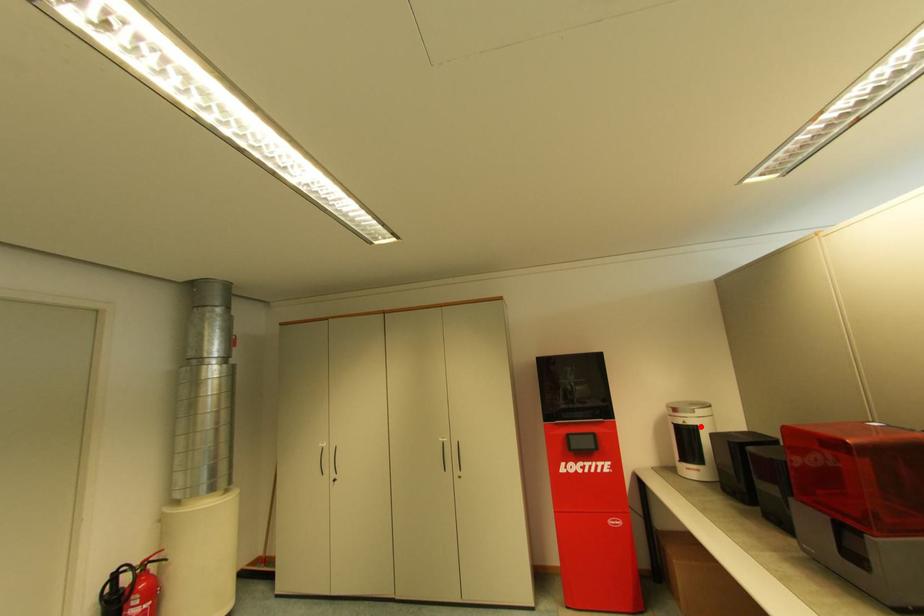
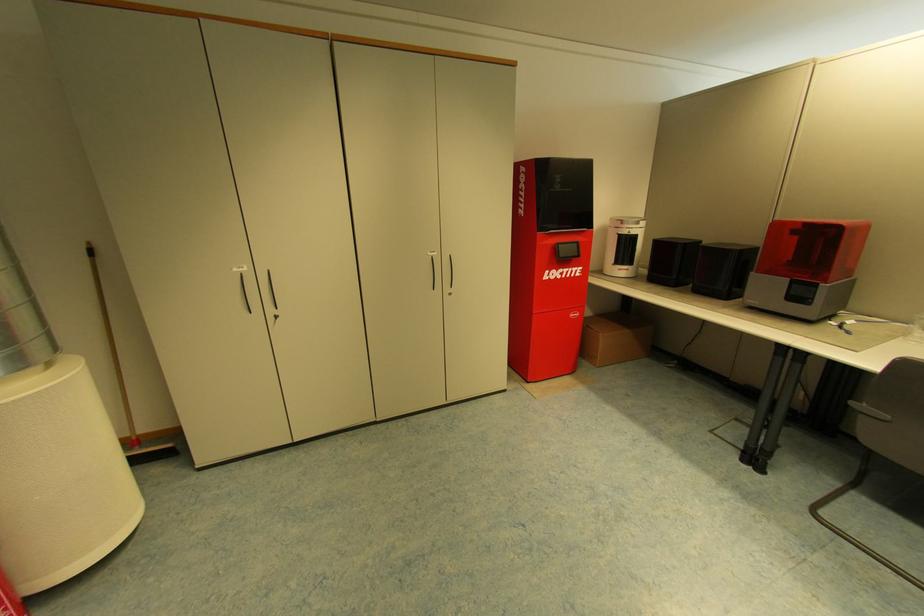
Find the pixel in the second image that matches the highlighted location in the first image.

(640, 236)